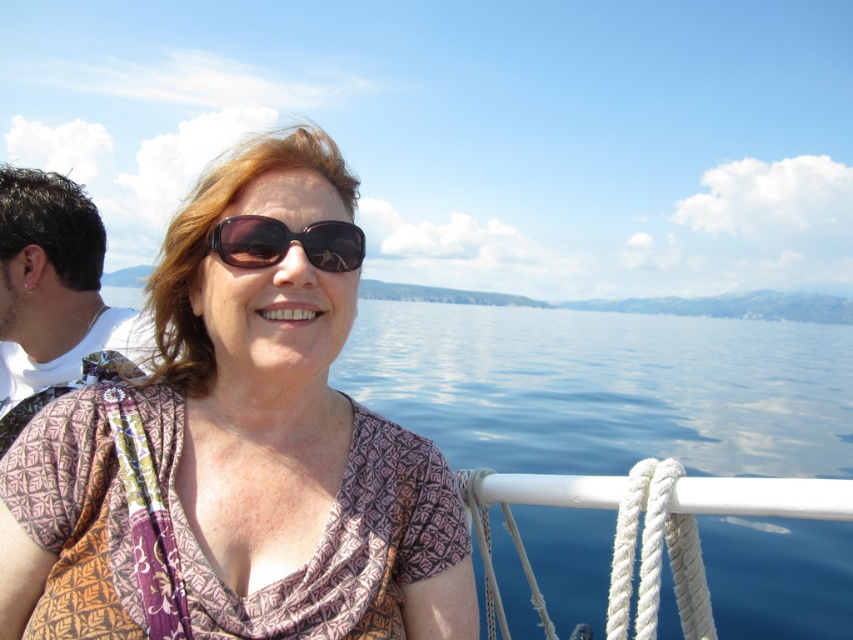
You are a photographer on a boat and want to capture a photo of the matte brown blouse at center and the white fabric at left. Which object is located to the right of the other?

The matte brown blouse at center is positioned on the right side of white fabric at left.

You are a photographer on the boat and want to capture both the white fabric at left and the matte brown sunglasses at center in a single shot. Which object should you position closer to the edge of the frame to ensure both fit without cropping?

Since the white fabric at left is wider than the matte brown sunglasses at center, you should position the white fabric at left closer to the edge of the frame to ensure both fit without cropping.

Where is the matte brown blouse at center located in the image?

The matte brown blouse at center is located at point coordinates of 0.713 in the x axis and 0.279 in the y axis.